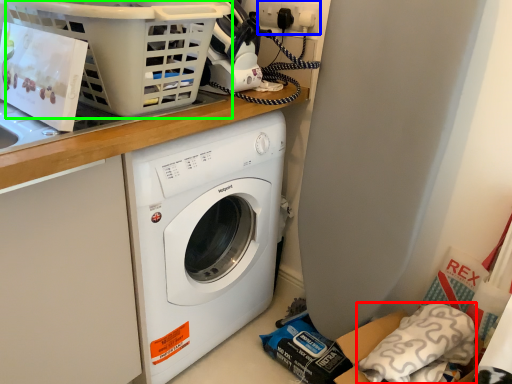
Question: Considering the real-world distances, which object is closest to pillow (highlighted by a red box)? electric outlet (highlighted by a blue box) or basket (highlighted by a green box).

Choices:
 (A) electric outlet
 (B) basket

Answer: (B)